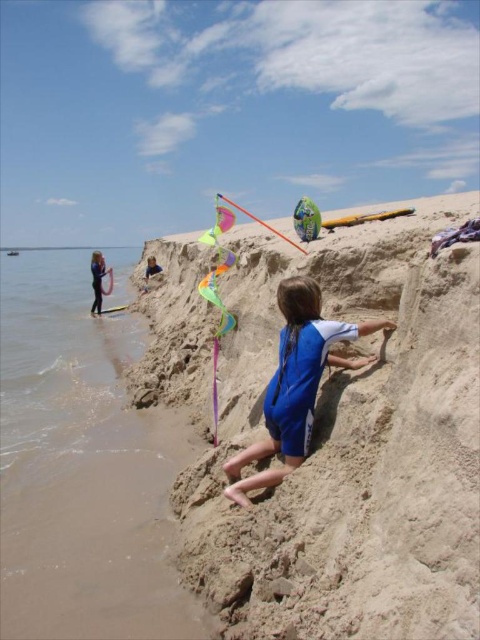
You are a child who wants to build a sandcastle. You see the smooth sandcastle at center and the brown sand at lower left. Which location would you choose to build your sandcastle, and why?

You should choose the brown sand at lower left because the smooth sandcastle at center is already built there, and the brown sand at lower left is a suitable location for building a new sandcastle.

You are a drone operator trying to capture aerial shots of the beach. Your drone is currently hovering at point coordinates of 0.5, 0.5. You need to move it to the smooth sandcastle at center. What direction should you move the drone to reach the sandcastle?

The smooth sandcastle at center is located at coordinates (351,445). Since the drone is at (240,320), you should move it northeast to reach the sandcastle.

You are a drone operator trying to capture a photo of the smooth sandcastle at center. The drone is currently hovering at point A, which is at coordinates 0.5, 0.5. The sandcastle is located at point B, which is at coordinates (351, 445). To get a clear shot, the drone needs to move directly towards the sandcastle. In which direction should the drone move from point A to reach the sandcastle at point B?

The drone should move northeast from point A to reach the sandcastle at point B because point B has higher x and y coordinates than point A.